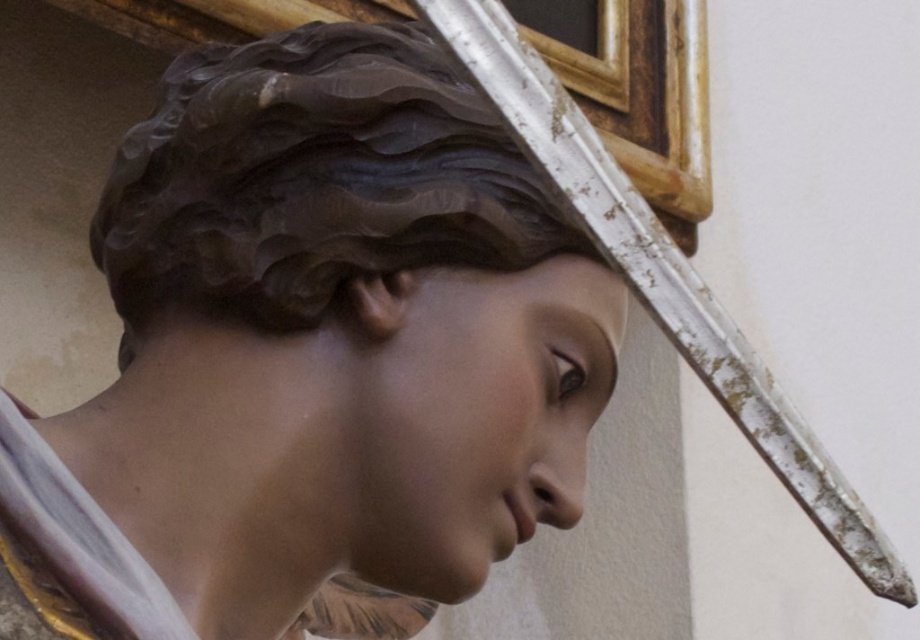
How much distance is there between matte brown statue at center and white weathered wood cross at upper center?

The distance of matte brown statue at center from white weathered wood cross at upper center is 7.04 inches.

Does point (411, 188) come farther from viewer compared to point (621, 205)?

Yes, it is behind point (621, 205).

In order to click on matte brown statue at center in this screenshot , I will do `click(357, 304)`.